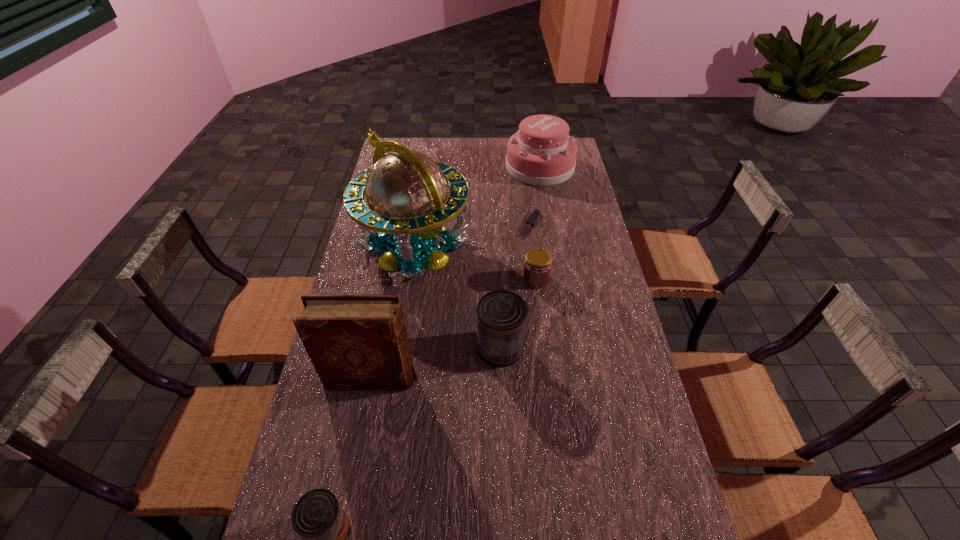
I want to click on vacant position located 0.270m on the right of the tallest object, so click(545, 246).

The image size is (960, 540). In order to click on vacant area situated 0.110m on the spine side of the sixth shortest object in this screenshot , I will do `click(454, 378)`.

Locate an element on the screen. The height and width of the screenshot is (540, 960). vacant point located 0.220m on the front of the sixth tallest object is located at coordinates (544, 343).

Locate an element on the screen. Image resolution: width=960 pixels, height=540 pixels. object at the far edge is located at coordinates (541, 153).

Where is `globe that is at the left edge`? globe that is at the left edge is located at coordinates (406, 191).

This screenshot has height=540, width=960. In order to click on hardback book situated at the left edge in this screenshot , I will do `click(355, 342)`.

The width and height of the screenshot is (960, 540). I want to click on object that is at the right edge, so click(541, 153).

I want to click on object that is at the far right corner, so click(x=541, y=153).

Where is `vacant region at the far edge of the desktop`? Image resolution: width=960 pixels, height=540 pixels. vacant region at the far edge of the desktop is located at coordinates (457, 139).

You are a GUI agent. You are given a task and a screenshot of the screen. Output one action in this format:
    pyautogui.click(x=<x>, y=<y>)
    Task: Click on the free space at the right edge of the desktop
    This screenshot has width=960, height=540.
    Given the screenshot: What is the action you would take?
    pyautogui.click(x=601, y=297)